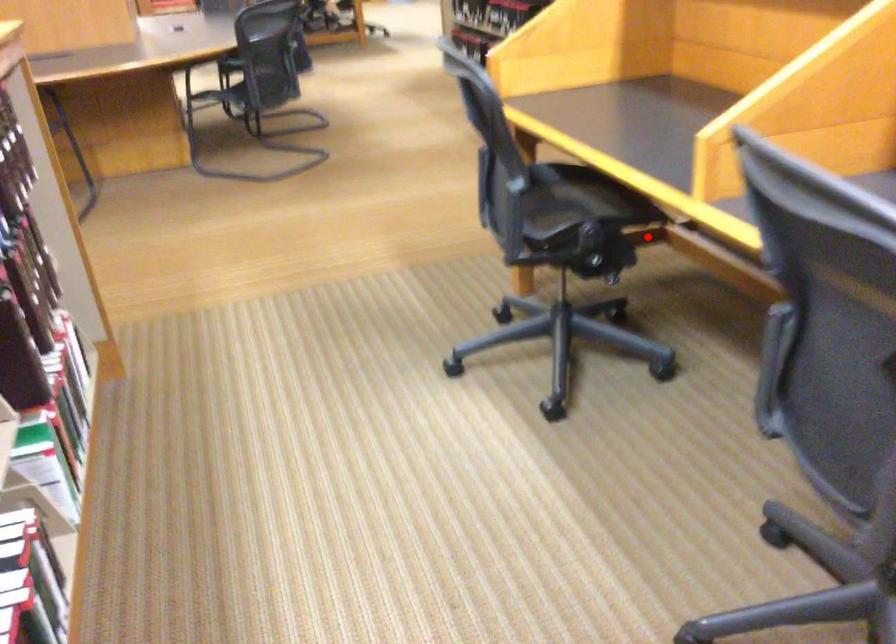
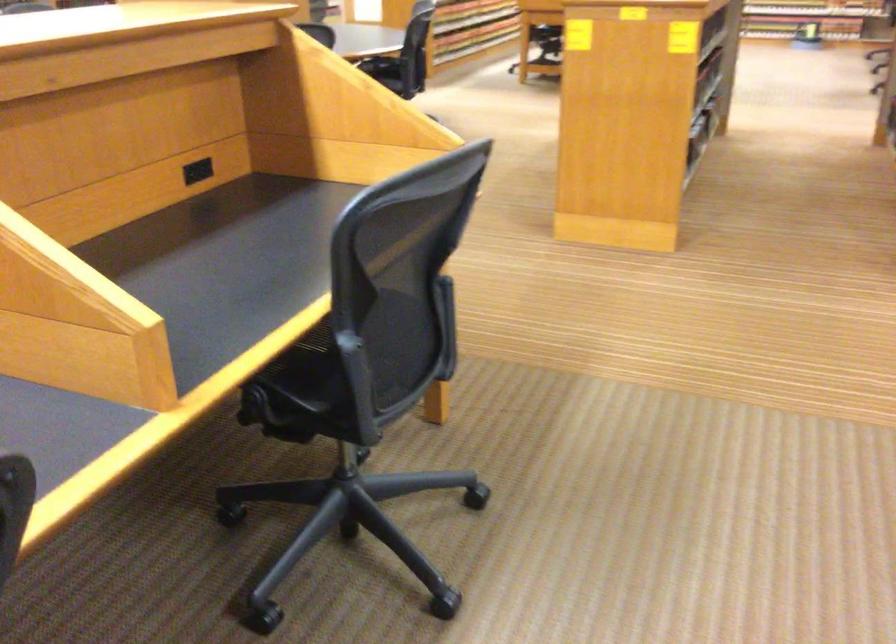
Question: I am providing you with two images of the same scene from different viewpoints. A red point is marked on the first image. Can you still see the location of the red point in image 2?

Choices:
 (A) Yes
 (B) No

Answer: (B)